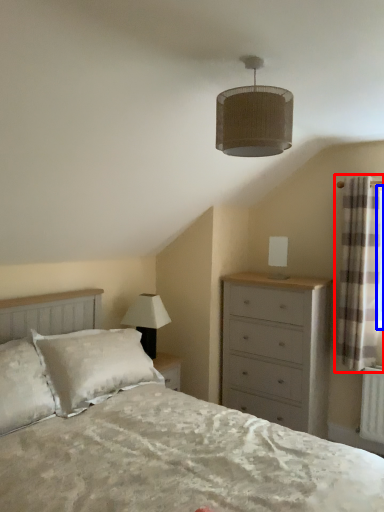
Question: Which point is further to the camera, curtain (highlighted by a red box) or window screen (highlighted by a blue box)?

Choices:
 (A) curtain
 (B) window screen

Answer: (B)